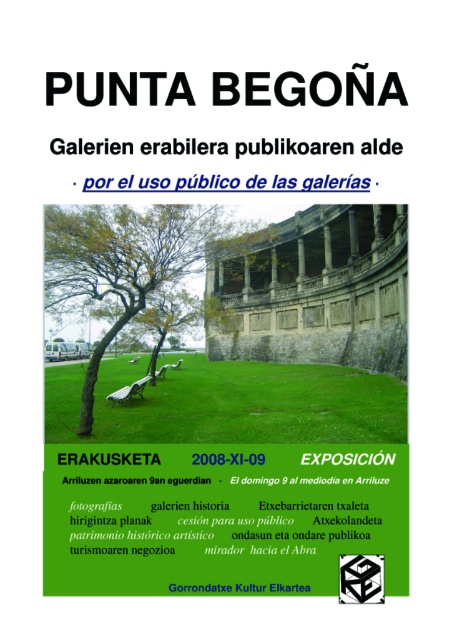
Based on the poster description, where is the green grass at center located in terms of coordinates?

The green grass at center is located at point coordinates of [230,404].

You are standing in the park depicted in the poster and want to walk towards the green leafy tree at center. Which direction should you face to ensure the green grass at center is on your right?

You should face north to have the green grass at center on your right when walking towards the green leafy tree at center. However, without specific directional markers in the scene, the most accurate answer based on the description is that the green grass at center is to the right of the green leafy tree at center. Therefore, to have the grass on your right while approaching the tree, you should position yourself so that the tree is to your front and the grass is to your right, which would mean facing the